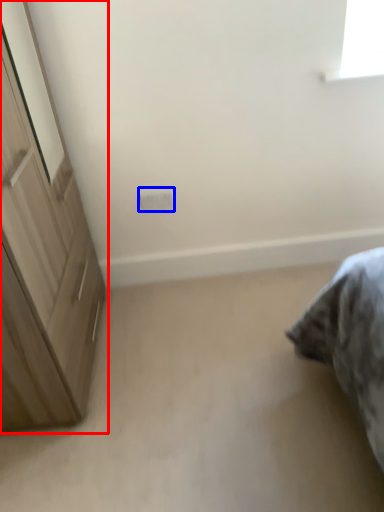
Question: Which of the following is the farthest to the observer, cupboard (highlighted by a red box) or electric outlet (highlighted by a blue box)?

Choices:
 (A) cupboard
 (B) electric outlet

Answer: (B)